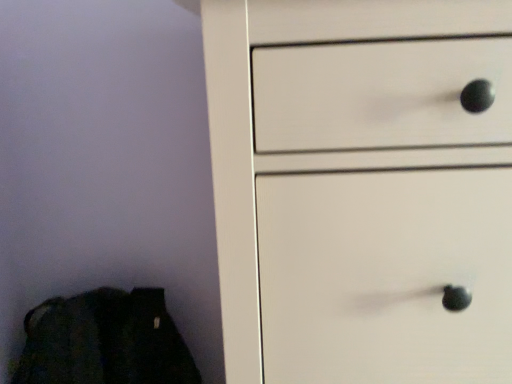
In order to click on white matte chest of drawers at center in this screenshot , I will do click(x=362, y=188).

What is the approximate height of white matte chest of drawers at center?

The height of white matte chest of drawers at center is 82.16 centimeters.

Image resolution: width=512 pixels, height=384 pixels. What do you see at coordinates (362, 188) in the screenshot? I see `white matte chest of drawers at center` at bounding box center [362, 188].

Where is `white matte chest of drawers at center`? This screenshot has height=384, width=512. white matte chest of drawers at center is located at coordinates (362, 188).